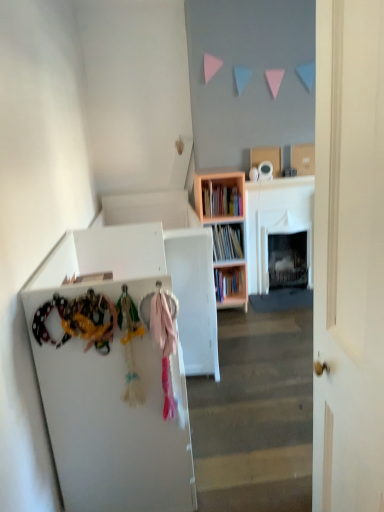
Find the location of a particular element. This screenshot has height=512, width=384. white matte door at center is located at coordinates (349, 256).

Identify the location of white matte cabinet at left. This screenshot has height=512, width=384. tap(111, 383).

You are a GUI agent. You are given a task and a screenshot of the screen. Output one action in this format:
    pyautogui.click(x=<x>, y=<y>)
    Task: Click on the pink fabric scarf at center
    This screenshot has width=384, height=512.
    Given the screenshot: What is the action you would take?
    pyautogui.click(x=164, y=345)

Can you confirm if wooden bookshelf at center is thinner than white matte door at center?

No, wooden bookshelf at center is not thinner than white matte door at center.

How many degrees apart are the facing directions of wooden bookshelf at center and white matte door at center?

They differ by 85 degrees in their facing directions.

Looking at this image, is wooden bookshelf at center bigger than white matte door at center?

Actually, wooden bookshelf at center might be smaller than white matte door at center.

Considering the relative positions of pink wood bookcase at center and pink fabric scarf at center in the image provided, is pink wood bookcase at center to the left of pink fabric scarf at center from the viewer's perspective?

Incorrect, pink wood bookcase at center is not on the left side of pink fabric scarf at center.

From the image's perspective, which one is positioned higher, pink wood bookcase at center or pink fabric scarf at center?

pink wood bookcase at center appears higher in the image.

Is pink wood bookcase at center facing away from pink fabric scarf at center?

No, pink fabric scarf at center is not at the back of pink wood bookcase at center.

Is point (366, 326) closer or farther from the camera than point (205, 212)?

Point (366, 326) is closer to the camera than point (205, 212).

Considering the sizes of objects white matte door at center and wooden bookshelf at center in the image provided, who is thinner, white matte door at center or wooden bookshelf at center?

With smaller width is white matte door at center.

Is white matte door at center not near wooden bookshelf at center?

Yes, white matte door at center is far from wooden bookshelf at center.

In the scene shown: Can you confirm if white matte door at center is taller than wooden bookshelf at center?

Indeed, white matte door at center has a greater height compared to wooden bookshelf at center.

Is pink wood bookcase at center wider or thinner than wooden bookshelf at center?

Considering their sizes, pink wood bookcase at center looks broader than wooden bookshelf at center.

Which of these two, pink wood bookcase at center or wooden bookshelf at center, stands taller?

With more height is pink wood bookcase at center.

From the picture: From the image's perspective, who appears lower, pink wood bookcase at center or wooden bookshelf at center?

pink wood bookcase at center is shown below in the image.

You are a GUI agent. You are given a task and a screenshot of the screen. Output one action in this format:
    pyautogui.click(x=<x>, y=<y>)
    Task: Click on the book above the pink wood bookcase at center (from the image's perspective)
    
    Given the screenshot: What is the action you would take?
    pyautogui.click(x=221, y=200)

Considering the relative sizes of pink fabric scarf at center and white matte cabinet at left in the image provided, is pink fabric scarf at center smaller than white matte cabinet at left?

Correct, pink fabric scarf at center occupies less space than white matte cabinet at left.

Which is closer to the camera, (166, 310) or (154, 473)?

The point (166, 310) is more forward.

In the image, is pink fabric scarf at center positioned in front of or behind white matte cabinet at left?

pink fabric scarf at center is in front of white matte cabinet at left.

Would you say pink fabric scarf at center is a long distance from wooden bookshelf at center?

Yes.

The width and height of the screenshot is (384, 512). I want to click on book that appears behind the pink fabric scarf at center, so click(x=221, y=200).

Which is closer to the camera, (x=169, y=375) or (x=229, y=190)?

The point (x=169, y=375) is closer.

How different are the orientations of pink fabric scarf at center and wooden bookshelf at center in degrees?

0.436 degrees separate the facing orientations of pink fabric scarf at center and wooden bookshelf at center.

From a real-world perspective, who is located higher, wooden bookshelf at center or white matte cabinet at left?

From a 3D spatial view, wooden bookshelf at center is above.

In the scene shown: Is wooden bookshelf at center positioned with its back to white matte cabinet at left?

No.

Relative to white matte cabinet at left, is wooden bookshelf at center in front or behind?

In the image, wooden bookshelf at center appears behind white matte cabinet at left.

Between wooden bookshelf at center and white matte cabinet at left, which one has less height?

wooden bookshelf at center is shorter.

Find the location of a particular element. The height and width of the screenshot is (512, 384). door in front of the wooden bookshelf at center is located at coordinates (349, 256).

Identify the location of bookcase below the pink fabric scarf at center (from a real-world perspective). (225, 232).

Looking at the image, which one is located further to white matte door at center, wooden bookshelf at center or white matte cabinet at left?

Among the two, wooden bookshelf at center is located further to white matte door at center.

From the picture: From the image, which object appears to be nearer to pink wood bookcase at center, wooden bookshelf at center or pink fabric scarf at center?

Based on the image, wooden bookshelf at center appears to be nearer to pink wood bookcase at center.

When comparing their distances from white matte cabinet at left, does wooden bookshelf at center or pink fabric scarf at center seem closer?

pink fabric scarf at center.

When comparing their distances from white matte door at center, does pink wood bookcase at center or pink fabric scarf at center seem closer?

Among the two, pink fabric scarf at center is located nearer to white matte door at center.

Considering their positions, is pink wood bookcase at center positioned further to pink fabric scarf at center than wooden bookshelf at center?

wooden bookshelf at center lies further to pink fabric scarf at center than the other object.

Looking at the image, which one is located further to pink wood bookcase at center, white matte door at center or white matte cabinet at left?

white matte door at center is further to pink wood bookcase at center.

Looking at the image, which one is located further to wooden bookshelf at center, white matte door at center or pink fabric scarf at center?

white matte door at center is positioned further to the anchor wooden bookshelf at center.

Based on their spatial positions, is pink wood bookcase at center or white matte cabinet at left further from white matte door at center?

The object further to white matte door at center is pink wood bookcase at center.

Locate an element on the screen. cabinetry positioned between white matte door at center and wooden bookshelf at center from near to far is located at coordinates (111, 383).

Locate an element on the screen. The image size is (384, 512). cabinetry between white matte door at center and pink wood bookcase at center in the front-back direction is located at coordinates (x=111, y=383).

Locate an element on the screen. The image size is (384, 512). clothing located between white matte door at center and wooden bookshelf at center in the depth direction is located at coordinates (164, 345).

Locate an element on the screen. The height and width of the screenshot is (512, 384). clothing between white matte door at center and pink wood bookcase at center in the front-back direction is located at coordinates (164, 345).